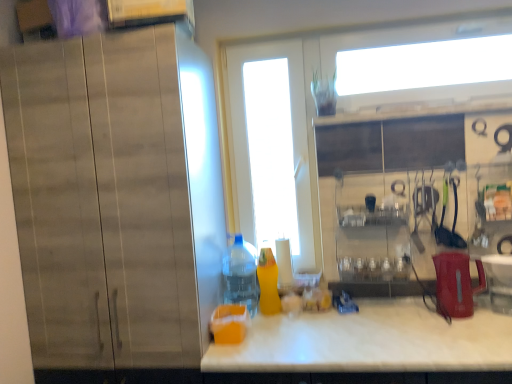
Question: Does white marble countertop at center appear on the right side of matte wood cabinet at left?

Choices:
 (A) no
 (B) yes

Answer: (B)

Question: From the image's perspective, is white marble countertop at center above matte wood cabinet at left?

Choices:
 (A) yes
 (B) no

Answer: (B)

Question: Would you say white marble countertop at center contains matte wood cabinet at left?

Choices:
 (A) yes
 (B) no

Answer: (B)

Question: Is white marble countertop at center at the left side of matte wood cabinet at left?

Choices:
 (A) no
 (B) yes

Answer: (A)

Question: Can you confirm if white marble countertop at center is smaller than matte wood cabinet at left?

Choices:
 (A) no
 (B) yes

Answer: (B)

Question: Does white marble countertop at center come in front of matte wood cabinet at left?

Choices:
 (A) yes
 (B) no

Answer: (A)

Question: Is translucent orange juice at lower center taller than white glossy screen door at center?

Choices:
 (A) yes
 (B) no

Answer: (B)

Question: Can you confirm if translucent orange juice at lower center is positioned to the left of white glossy screen door at center?

Choices:
 (A) no
 (B) yes

Answer: (B)

Question: Considering the relative positions of translucent orange juice at lower center and white glossy screen door at center in the image provided, is translucent orange juice at lower center to the right of white glossy screen door at center from the viewer's perspective?

Choices:
 (A) no
 (B) yes

Answer: (A)

Question: Can you confirm if translucent orange juice at lower center is wider than white glossy screen door at center?

Choices:
 (A) no
 (B) yes

Answer: (B)

Question: Considering the relative sizes of translucent orange juice at lower center and white glossy screen door at center in the image provided, is translucent orange juice at lower center bigger than white glossy screen door at center?

Choices:
 (A) yes
 (B) no

Answer: (B)

Question: From a real-world perspective, is translucent orange juice at lower center on top of white glossy screen door at center?

Choices:
 (A) yes
 (B) no

Answer: (B)

Question: From the image's perspective, is red plastic kettle at right on top of white glossy screen door at center?

Choices:
 (A) no
 (B) yes

Answer: (A)